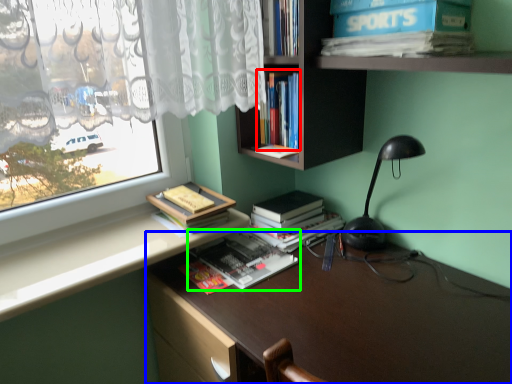
Question: Which object is positioned farthest from book (highlighted by a red box)? Select from desk (highlighted by a blue box) and book (highlighted by a green box).

Choices:
 (A) desk
 (B) book

Answer: (A)